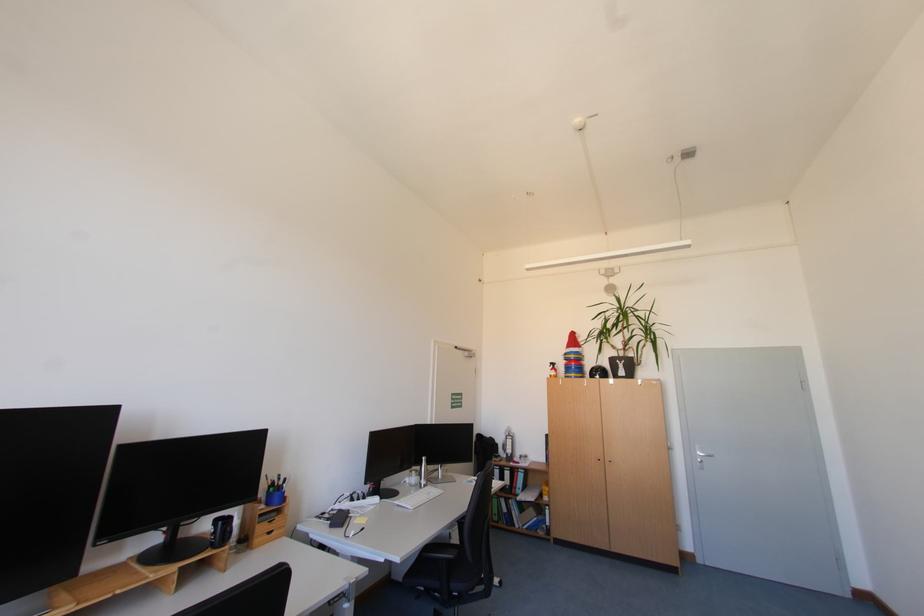
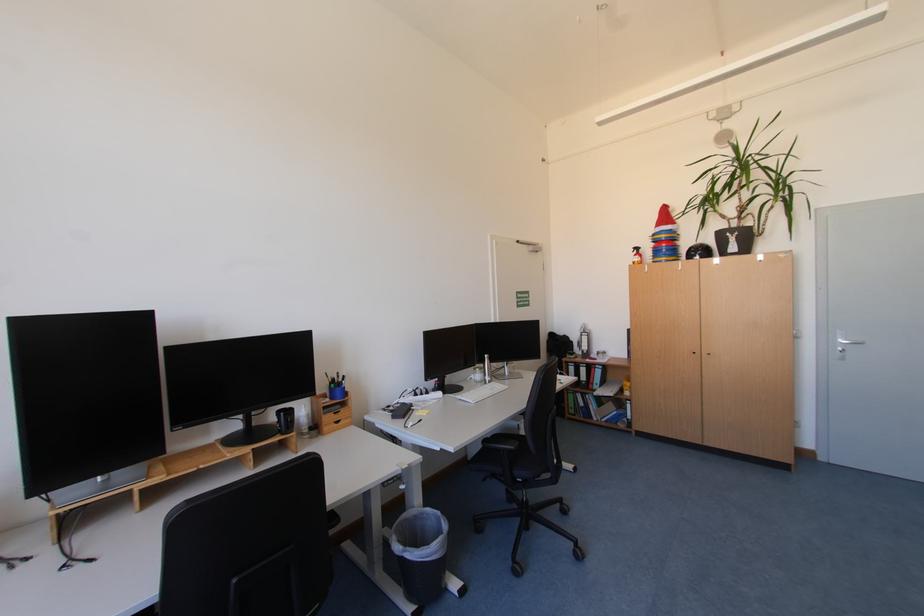
Find the pixel in the second image that matches (608,461) in the first image.

(701, 354)